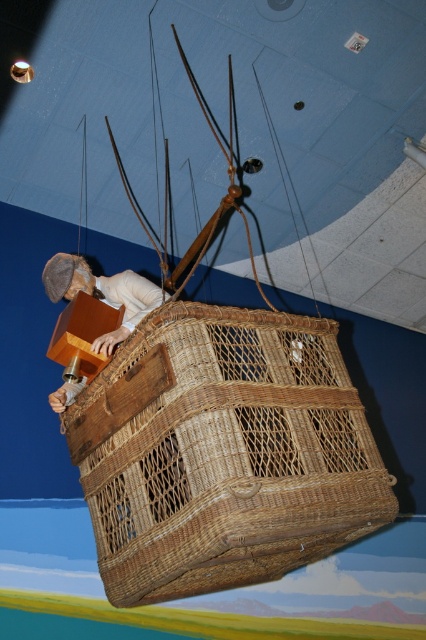
You are an architect designing a new exhibit and need to ensure the wooden figure at center and the woven brown basket at center are arranged correctly. According to the scene, which object is positioned lower?

The woven brown basket at center is positioned lower than the wooden figure at center.

You are an interior designer planning to place a 30 inch wide decorative item in the space between the woven brown basket at center and the wooden figure at center. Based on the given information, will the item fit between them?

The woven brown basket at center and wooden figure at center are 28.00 inches apart from each other. The decorative item is 30 inches wide, which is wider than the space available. Therefore, the item will not fit between them.

You are an event planner setting up a historical exhibit. You need to ensure that the wooden figure at center can be seen from below the woven brown basket at center. Is this possible given their current positions?

The woven brown basket at center is taller than the wooden figure at center. Therefore, the wooden figure at center is shorter and can be seen from below the basket.